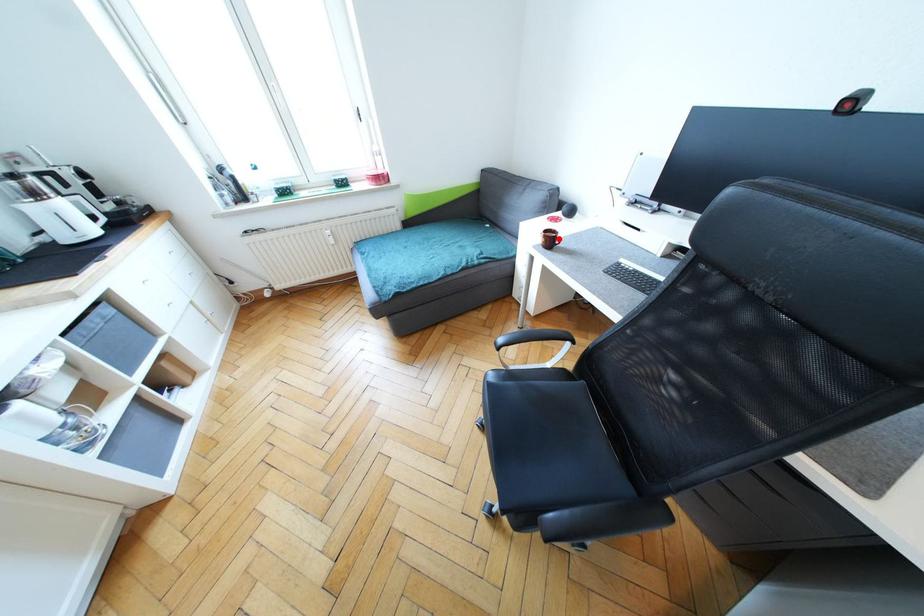
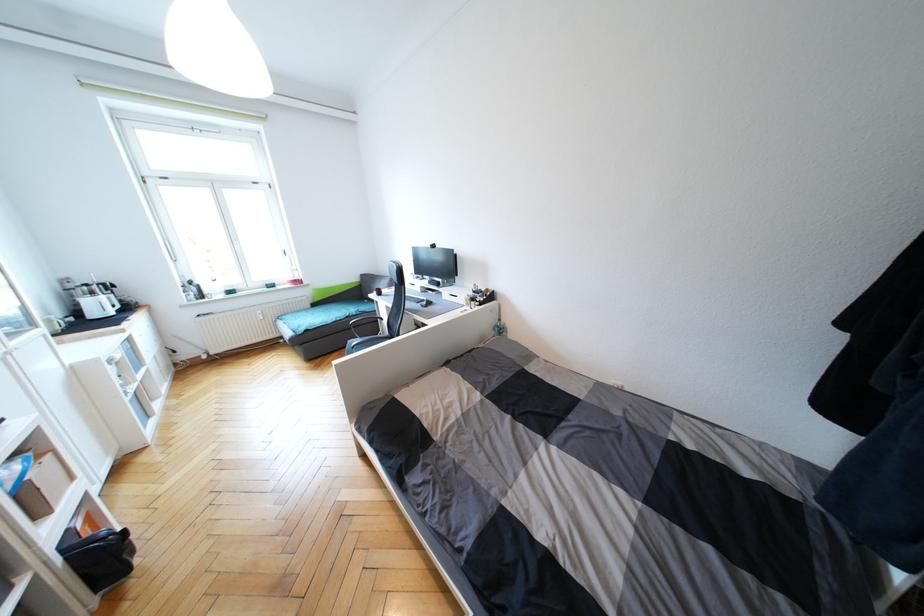
Question: I am providing you with two images of the same scene from different viewpoints. A red point is marked on the first image. Is the red point's position out of view in image 2?

Choices:
 (A) Yes
 (B) No

Answer: (A)